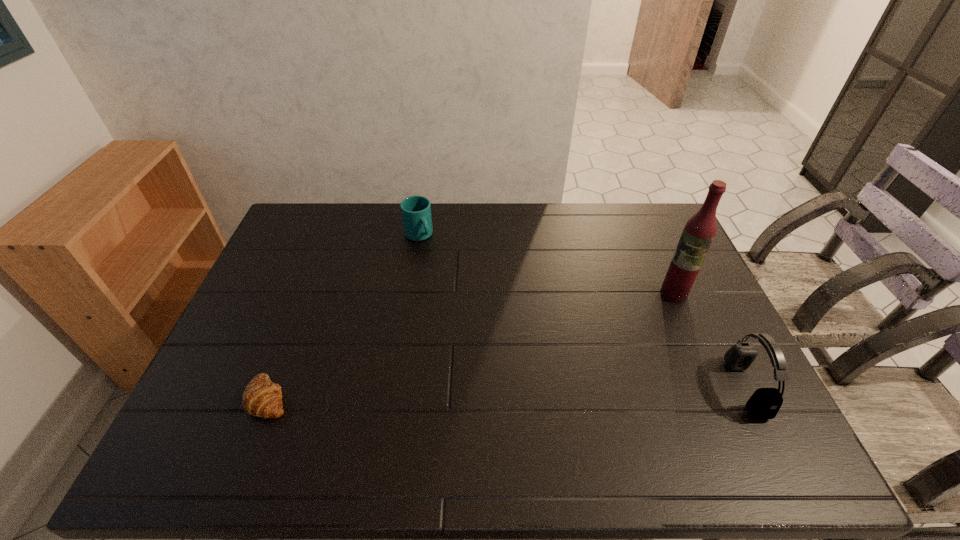
Locate an element on the screen. This screenshot has height=540, width=960. the leftmost object is located at coordinates (262, 398).

Identify the location of crescent roll. (262, 398).

Where is `headset`? This screenshot has width=960, height=540. headset is located at coordinates (765, 403).

You are a GUI agent. You are given a task and a screenshot of the screen. Output one action in this format:
    pyautogui.click(x=<x>, y=<y>)
    Task: Click on the rightmost object
    The height and width of the screenshot is (540, 960).
    Given the screenshot: What is the action you would take?
    pyautogui.click(x=765, y=403)

Where is `the third object from right to left`? Image resolution: width=960 pixels, height=540 pixels. the third object from right to left is located at coordinates (416, 210).

Where is `cup`? The height and width of the screenshot is (540, 960). cup is located at coordinates (416, 210).

This screenshot has height=540, width=960. I want to click on the tallest object, so click(699, 231).

Locate an element on the screen. The height and width of the screenshot is (540, 960). the second object from right to left is located at coordinates (699, 231).

The width and height of the screenshot is (960, 540). Find the location of `free space located on the right of the leftmost object`. free space located on the right of the leftmost object is located at coordinates (424, 397).

Where is `vacant point located on the headband of the rightmost object`? The width and height of the screenshot is (960, 540). vacant point located on the headband of the rightmost object is located at coordinates (699, 388).